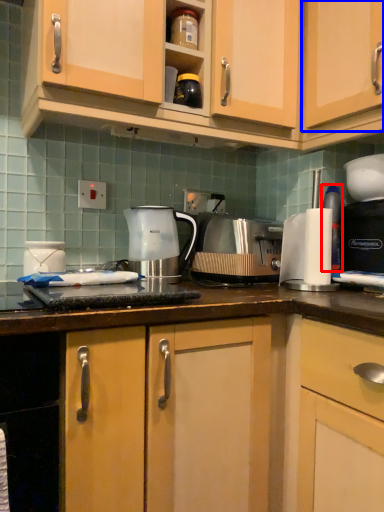
Question: Which object appears farthest to the camera in this image, bottle (highlighted by a red box) or cabinetry (highlighted by a blue box)?

Choices:
 (A) bottle
 (B) cabinetry

Answer: (A)